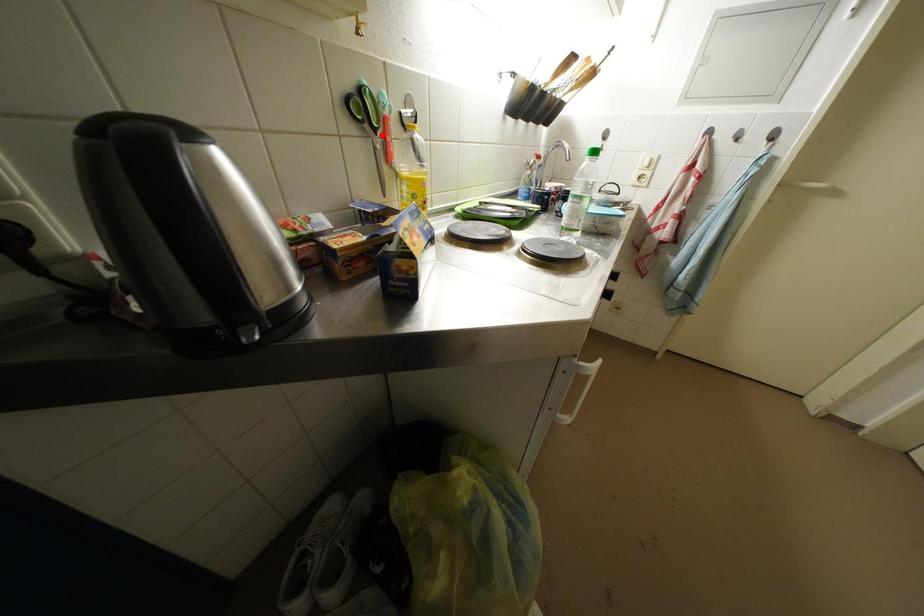
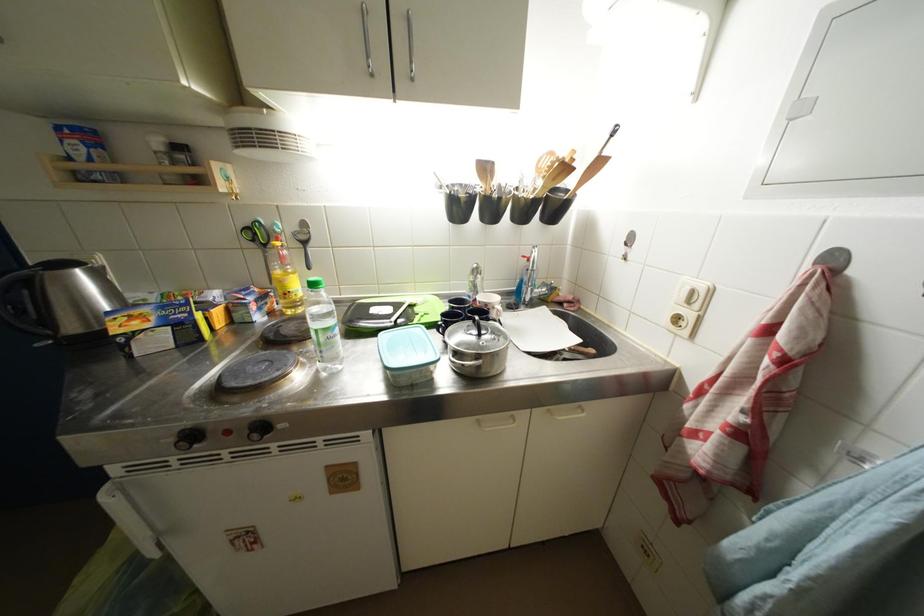
The point at the highlighted location is marked in the first image. Where is the corresponding point in the second image?

(272, 249)